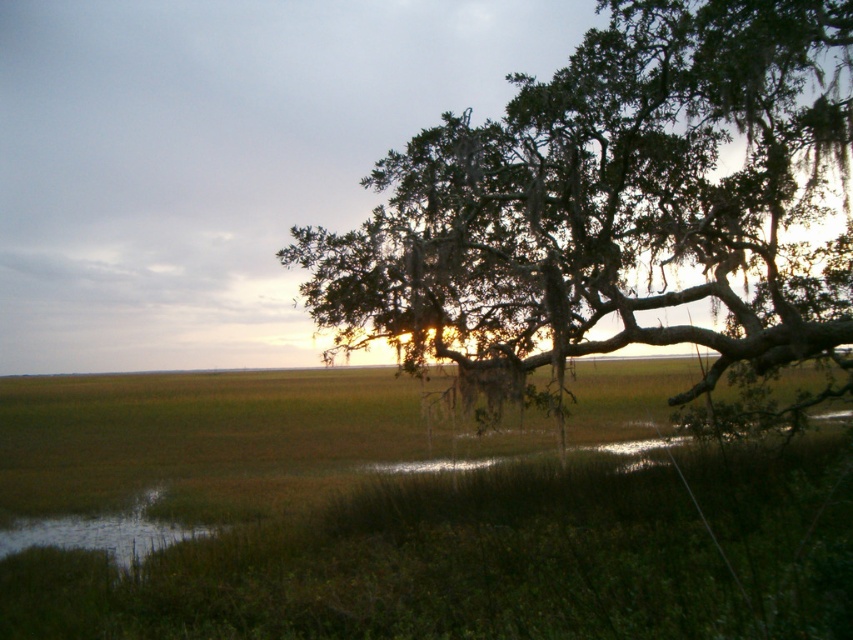
Who is positioned more to the left, green leafy tree at right or green grassy water at lower left?

green grassy water at lower left

Is point (454, 172) less distant than point (78, 524)?

That is True.

Locate an element on the screen. green leafy tree at right is located at coordinates (614, 204).